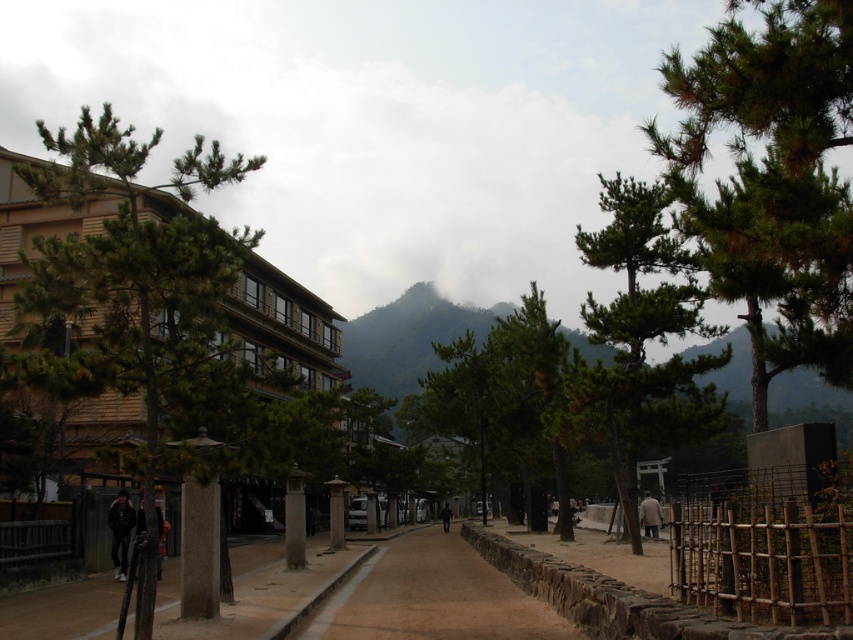
You are standing on the brown stone path at center and looking towards the green textured tree at right. Is the tree visible from your current position?

The green textured tree at right is above the brown stone path at center, so yes, the tree is visible from your current position on the brown stone path at center.

You are a tourist walking along the brown stone path at center and want to take a photo of the green textured tree at right. Based on their sizes, which object should you focus on first to ensure it appears clearly in your photo?

The green textured tree at right is larger in size than the brown stone path at center, so you should focus on the green textured tree at right first to ensure it appears clearly in your photo.